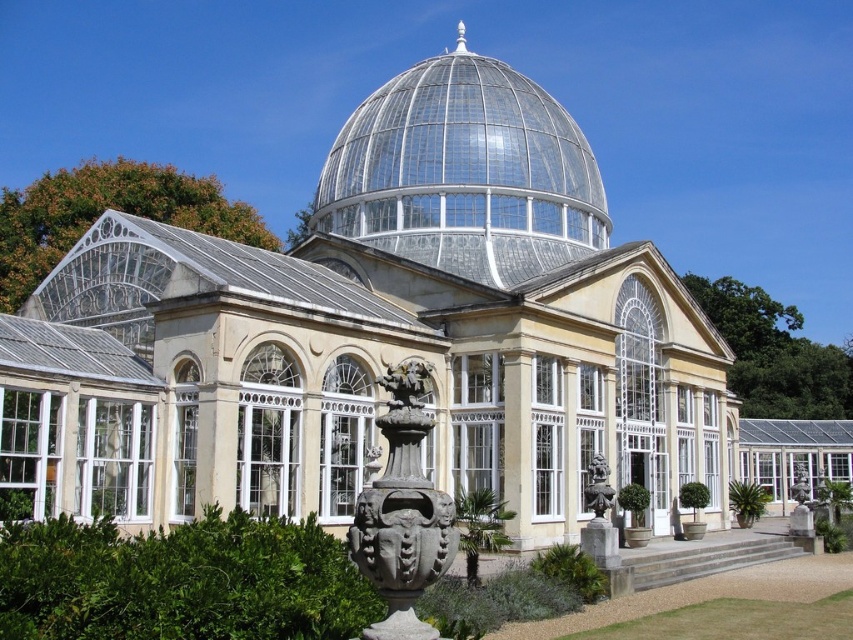
Between transparent glass dome at center and matte stone statue at lower center, which one appears on the right side from the viewer's perspective?

From the viewer's perspective, matte stone statue at lower center appears more on the right side.

Who is taller, transparent glass dome at center or matte stone statue at lower center?

Standing taller between the two is transparent glass dome at center.

Describe the element at coordinates (463, 173) in the screenshot. I see `transparent glass dome at center` at that location.

I want to click on transparent glass dome at center, so pos(463,173).

Does gray stone sculpture at center lie behind matte stone statue at lower center?

No, it is not.

Is gray stone sculpture at center above matte stone statue at lower center?

Yes, gray stone sculpture at center is above matte stone statue at lower center.

Does point (372, 625) come closer to viewer compared to point (601, 513)?

Yes, it is in front of point (601, 513).

The image size is (853, 640). Identify the location of gray stone sculpture at center. (402, 513).

Who is taller, transparent glass dome at center or gray stone sculpture at center?

With more height is transparent glass dome at center.

You are a GUI agent. You are given a task and a screenshot of the screen. Output one action in this format:
    pyautogui.click(x=<x>, y=<y>)
    Task: Click on the transparent glass dome at center
    The image size is (853, 640).
    Given the screenshot: What is the action you would take?
    pyautogui.click(x=463, y=173)